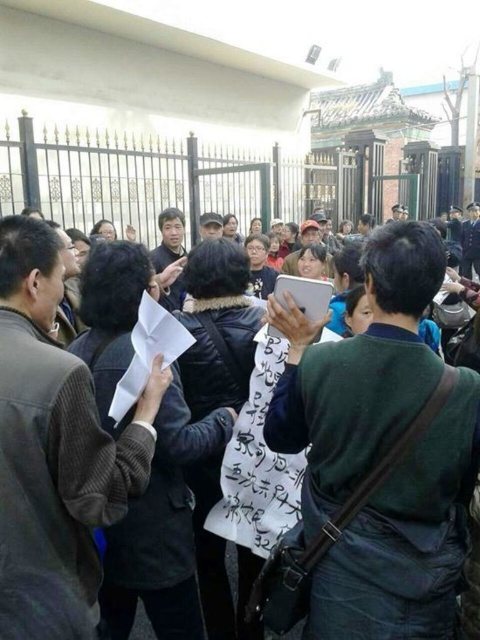
Question: Which point is farther to the camera?

Choices:
 (A) (372, 595)
 (B) (57, 460)

Answer: (A)

Question: Does green fabric shirt at center appear under white paper at center?

Choices:
 (A) yes
 (B) no

Answer: (A)

Question: From the image, what is the correct spatial relationship of green fabric shirt at center in relation to white paper at center?

Choices:
 (A) left
 (B) right

Answer: (B)

Question: In this image, where is green fabric shirt at center located relative to white paper at center?

Choices:
 (A) below
 (B) above

Answer: (A)

Question: Which point is closer to the camera taking this photo?

Choices:
 (A) (474, 435)
 (B) (35, 356)

Answer: (B)